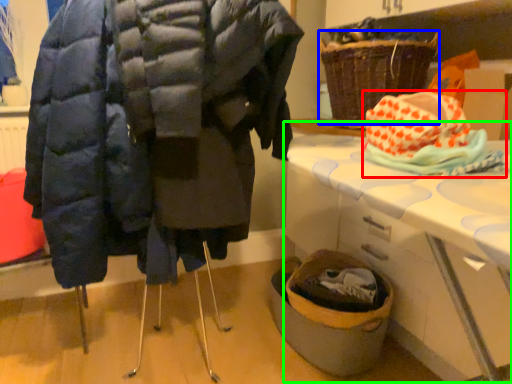
Question: Which is farther away from material (highlighted by a red box)? basket (highlighted by a blue box) or table (highlighted by a green box)?

Choices:
 (A) basket
 (B) table

Answer: (A)